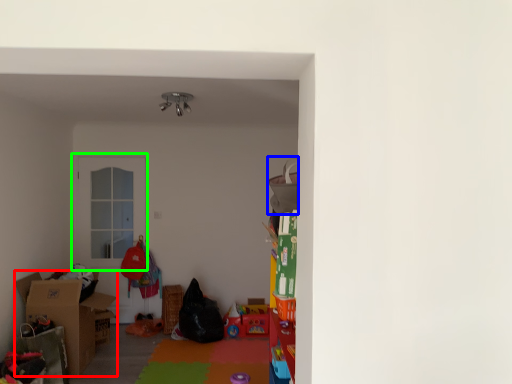
Question: Based on their relative distances, which object is nearer to box (highlighted by a red box)? Choose from bean bag chair (highlighted by a blue box) and door (highlighted by a green box).

Choices:
 (A) bean bag chair
 (B) door

Answer: (B)